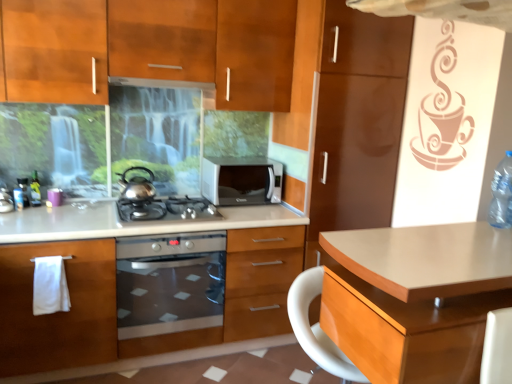
In order to click on satin silver gas stove at center in this screenshot , I will do `click(166, 209)`.

You are a GUI agent. You are given a task and a screenshot of the screen. Output one action in this format:
    pyautogui.click(x=<x>, y=<y>)
    Task: Click on the shiny metallic kettle at center
    The image size is (512, 384).
    Given the screenshot: What is the action you would take?
    pyautogui.click(x=137, y=187)

Identify the location of satin silver oven at center. (169, 283).

At what (x,y) coordinates should I click in order to perform the action: click on matte wood desk at center. Please return your answer as a coordinate pair (x, y). Looking at the image, I should click on (415, 298).

Measure the distance between point (388, 264) and camera.

Point (388, 264) and camera are 4.29 feet apart.

What is the approximate height of satin silver microwave at center?

The height of satin silver microwave at center is 29.38 centimeters.

Measure the distance between point (132, 80) and camera.

2.43 meters.

Locate an element on the screen. This screenshot has height=384, width=512. matte stainless steel exhaust hood at upper center is located at coordinates (165, 84).

The width and height of the screenshot is (512, 384). I want to click on satin silver gas stove at center, so click(x=166, y=209).

Find the location of a particular element. exhaust hood that is above the satin silver oven at center (from the image's perspective) is located at coordinates (165, 84).

Considering the points (141, 249) and (199, 87), which point is behind, point (141, 249) or point (199, 87)?

The point (199, 87) is farther.

Is satin silver oven at center turned away from matte stainless steel exhaust hood at upper center?

That's not correct — satin silver oven at center is not looking away from matte stainless steel exhaust hood at upper center.

Is satin silver gas stove at center facing away from matte wood oven at center, the 2th cabinetry when ordered from top to bottom?

Yes, satin silver gas stove at center is positioned with its back facing matte wood oven at center, the 2th cabinetry when ordered from top to bottom.

Visually, is satin silver gas stove at center positioned to the left or to the right of matte wood oven at center, marked as the first cabinetry in a bottom-to-top arrangement?

satin silver gas stove at center is positioned on matte wood oven at center, marked as the first cabinetry in a bottom-to-top arrangement,'s right side.

Does satin silver gas stove at center have a greater width compared to matte wood oven at center, marked as the first cabinetry in a bottom-to-top arrangement?

No, satin silver gas stove at center is not wider than matte wood oven at center, marked as the first cabinetry in a bottom-to-top arrangement.

Find the location of a particular element. gas stove above the matte wood oven at center, the 2th cabinetry when ordered from top to bottom (from the image's perspective) is located at coordinates (166, 209).

Does satin silver microwave at center come behind satin silver gas stove at center?

Yes, it is.

Between satin silver microwave at center and satin silver gas stove at center, which one has smaller width?

satin silver microwave at center.

In the scene shown: Are satin silver microwave at center and satin silver gas stove at center located far from each other?

No, satin silver microwave at center is not far from satin silver gas stove at center.

Can satin silver gas stove at center be found inside satin silver microwave at center?

No, satin silver microwave at center does not contain satin silver gas stove at center.

Between satin silver gas stove at center and matte stainless steel exhaust hood at upper center, which one has smaller width?

Thinner between the two is matte stainless steel exhaust hood at upper center.

From the image's perspective, which one is positioned lower, satin silver gas stove at center or matte stainless steel exhaust hood at upper center?

satin silver gas stove at center.

Do you think satin silver gas stove at center is within matte stainless steel exhaust hood at upper center, or outside of it?

satin silver gas stove at center lies outside matte stainless steel exhaust hood at upper center.

Between point (165, 201) and point (145, 84), which one is positioned behind?

The point (145, 84) is more distant.

Does satin silver gas stove at center appear on the left side of shiny metallic kettle at center?

No.

From the image's perspective, is satin silver gas stove at center positioned above or below shiny metallic kettle at center?

From the image's perspective, satin silver gas stove at center appears below shiny metallic kettle at center.

Does point (170, 212) lie in front of point (143, 188)?

Yes, point (170, 212) is closer to viewer.

Which is less distant, (134, 84) or (489, 221)?

Point (134, 84) is positioned farther from the camera compared to point (489, 221).

The image size is (512, 384). Find the location of `exhaust hood above the clear plastic bottle at right, which ranks as the first bottle in front-to-back order (from a real-world perspective)`. exhaust hood above the clear plastic bottle at right, which ranks as the first bottle in front-to-back order (from a real-world perspective) is located at coordinates (165, 84).

Is matte stainless steel exhaust hood at upper center with clear plastic bottle at right, which ranks as the first bottle in front-to-back order?

They are not placed beside each other.

Looking at this image, what's the angular difference between matte stainless steel exhaust hood at upper center and clear plastic bottle at right, placed as the second bottle when sorted from left to right,'s facing directions?

They differ by 84.6 degrees in their facing directions.

From the image's perspective, between shiny metallic kettle at center and clear plastic bottle at right, arranged as the first bottle when viewed from the right, which one is located above?

shiny metallic kettle at center.

Which of these two, shiny metallic kettle at center or clear plastic bottle at right, arranged as the first bottle when viewed from the right, is wider?

Wider between the two is shiny metallic kettle at center.

Which is more to the left, shiny metallic kettle at center or clear plastic bottle at right, the 2th bottle when ordered from back to front?

Positioned to the left is shiny metallic kettle at center.

Is point (139, 167) more distant than point (492, 186)?

Yes, it is behind point (492, 186).

The width and height of the screenshot is (512, 384). I want to click on home appliance located in front of the matte stainless steel exhaust hood at upper center, so click(169, 283).

The height and width of the screenshot is (384, 512). Find the location of `gas stove on the right of the matte wood oven at center, marked as the first cabinetry in a bottom-to-top arrangement`. gas stove on the right of the matte wood oven at center, marked as the first cabinetry in a bottom-to-top arrangement is located at coordinates (166, 209).

When comparing their distances from matte wood cabinets at upper center, which appears as the first cabinetry when viewed from the top, does satin silver gas stove at center or metallic silver bottle at left, positioned as the 1th bottle in left-to-right order, seem further?

Based on the image, metallic silver bottle at left, positioned as the 1th bottle in left-to-right order, appears to be further to matte wood cabinets at upper center, which appears as the first cabinetry when viewed from the top.

Estimate the real-world distances between objects in this image. Which object is further from matte wood oven at center, the 2th cabinetry when ordered from top to bottom, satin silver gas stove at center or clear plastic bottle at right, the 2th bottle when ordered from back to front?

The object further to matte wood oven at center, the 2th cabinetry when ordered from top to bottom, is clear plastic bottle at right, the 2th bottle when ordered from back to front.

Which object lies further to the anchor point clear plastic bottle at right, which ranks as the first bottle in front-to-back order, satin silver gas stove at center or matte wood cabinets at upper center, which appears as the first cabinetry when viewed from the top?

satin silver gas stove at center lies further to clear plastic bottle at right, which ranks as the first bottle in front-to-back order, than the other object.

Considering their positions, is satin silver oven at center positioned further to satin silver microwave at center than matte wood oven at center, marked as the first cabinetry in a bottom-to-top arrangement?

matte wood oven at center, marked as the first cabinetry in a bottom-to-top arrangement, lies further to satin silver microwave at center than the other object.

When comparing their distances from matte wood desk at center, does shiny metallic kettle at center or satin silver oven at center seem closer?

Based on the image, satin silver oven at center appears to be nearer to matte wood desk at center.

Considering their positions, is matte wood cabinets at upper center, which appears as the first cabinetry when viewed from the top, positioned further to matte stainless steel exhaust hood at upper center than shiny metallic kettle at center?

shiny metallic kettle at center.

Looking at this image, considering their positions, is matte stainless steel exhaust hood at upper center positioned further to satin silver gas stove at center than shiny metallic kettle at center?

matte stainless steel exhaust hood at upper center is positioned further to the anchor satin silver gas stove at center.

Based on their spatial positions, is clear plastic bottle at right, placed as the second bottle when sorted from left to right, or matte wood oven at center, marked as the first cabinetry in a bottom-to-top arrangement, further from matte wood cabinets at upper center, the second cabinetry when ordered from bottom to top?

clear plastic bottle at right, placed as the second bottle when sorted from left to right, lies further to matte wood cabinets at upper center, the second cabinetry when ordered from bottom to top, than the other object.

Identify the location of gas stove between matte stainless steel exhaust hood at upper center and matte wood oven at center, the 2th cabinetry when ordered from top to bottom, from top to bottom. (166, 209).

The height and width of the screenshot is (384, 512). Find the location of `microwave oven between matte wood cabinets at upper center, the second cabinetry when ordered from bottom to top, and matte wood oven at center, the 2th cabinetry when ordered from top to bottom, in the up-down direction`. microwave oven between matte wood cabinets at upper center, the second cabinetry when ordered from bottom to top, and matte wood oven at center, the 2th cabinetry when ordered from top to bottom, in the up-down direction is located at coordinates [x=242, y=180].

Locate an element on the screen. The image size is (512, 384). desk between metallic silver bottle at left, positioned as the 1th bottle in left-to-right order, and clear plastic bottle at right, arranged as the first bottle when viewed from the right, from left to right is located at coordinates (415, 298).

This screenshot has width=512, height=384. Identify the location of gas stove between matte wood cabinets at upper center, the second cabinetry when ordered from bottom to top, and matte wood desk at center from left to right. (166, 209).